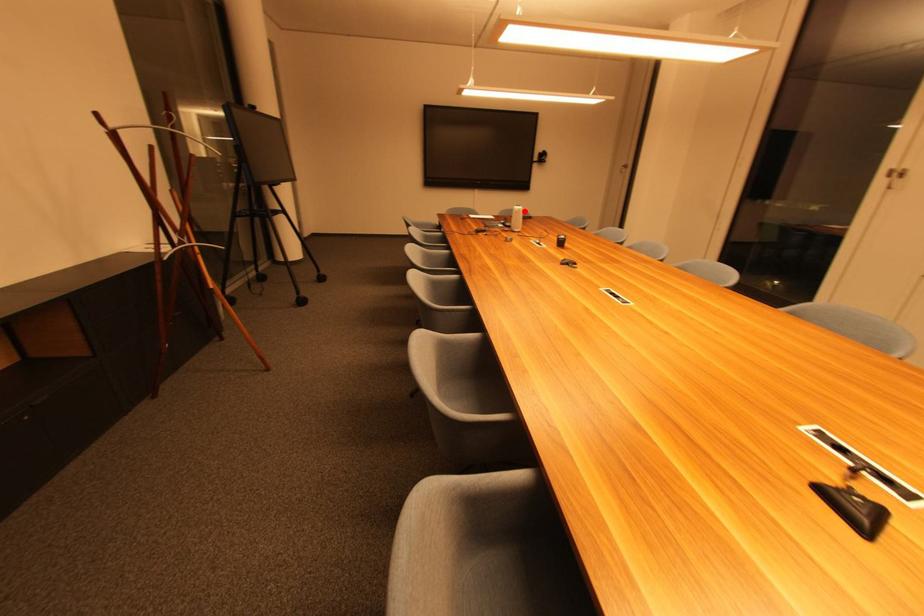
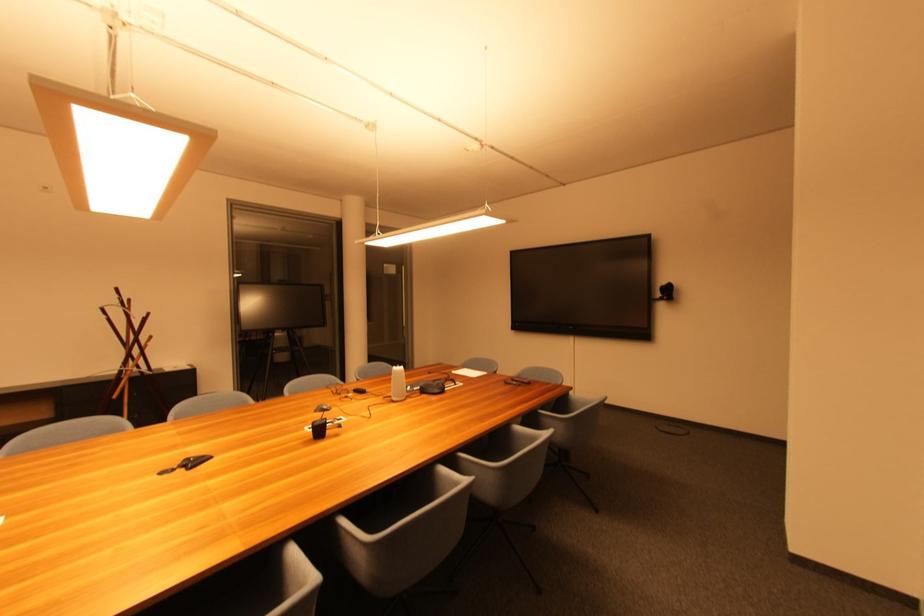
Question: I am providing you with two images of the same scene from different viewpoints. A red point is shown in image1. For the corresponding object point in image2, is it positioned nearer or farther from the camera?

Choices:
 (A) Nearer
 (B) Farther

Answer: (A)